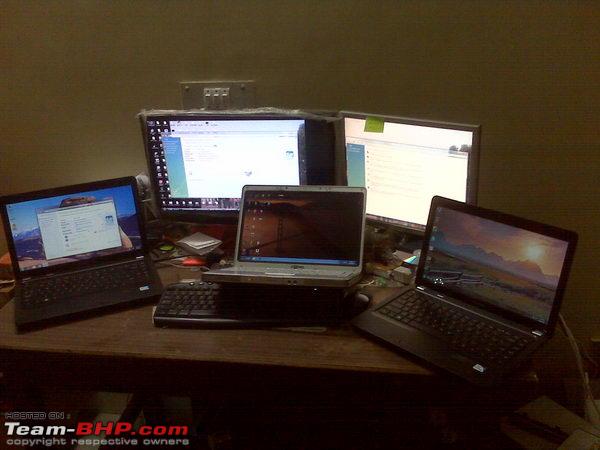
Where is `keyboard`? The width and height of the screenshot is (600, 450). keyboard is located at coordinates (206, 317).